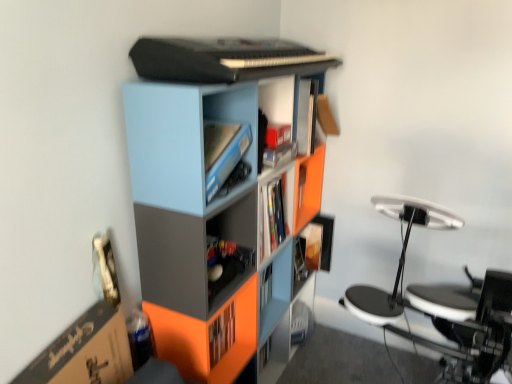
Question: Should I look upward or downward to see light blue plastic cabinet at upper center?

Choices:
 (A) up
 (B) down

Answer: (A)

Question: Does light blue plastic cabinet at upper center come behind matte black shelf at center?

Choices:
 (A) no
 (B) yes

Answer: (A)

Question: From the image's perspective, is light blue plastic cabinet at upper center under matte black shelf at center?

Choices:
 (A) no
 (B) yes

Answer: (A)

Question: Is light blue plastic cabinet at upper center wider than matte black shelf at center?

Choices:
 (A) yes
 (B) no

Answer: (A)

Question: Is light blue plastic cabinet at upper center thinner than matte black shelf at center?

Choices:
 (A) no
 (B) yes

Answer: (A)

Question: Is light blue plastic cabinet at upper center smaller than matte black shelf at center?

Choices:
 (A) no
 (B) yes

Answer: (A)

Question: Does light blue plastic cabinet at upper center appear on the left side of matte black shelf at center?

Choices:
 (A) yes
 (B) no

Answer: (A)

Question: Can matte plastic bookcase at center be found inside matte black shelf at center?

Choices:
 (A) no
 (B) yes

Answer: (A)

Question: Can we say matte black shelf at center lies outside matte plastic bookcase at center?

Choices:
 (A) no
 (B) yes

Answer: (A)

Question: From the image's perspective, does matte black shelf at center appear higher than matte plastic bookcase at center?

Choices:
 (A) yes
 (B) no

Answer: (B)

Question: Would you say matte black shelf at center is a long distance from matte plastic bookcase at center?

Choices:
 (A) yes
 (B) no

Answer: (B)

Question: Is matte black shelf at center behind matte plastic bookcase at center?

Choices:
 (A) yes
 (B) no

Answer: (A)

Question: From a real-world perspective, is matte black shelf at center below matte plastic bookcase at center?

Choices:
 (A) yes
 (B) no

Answer: (B)

Question: Is matte black shelf at center at the right side of light blue plastic cabinet at upper center?

Choices:
 (A) no
 (B) yes

Answer: (B)